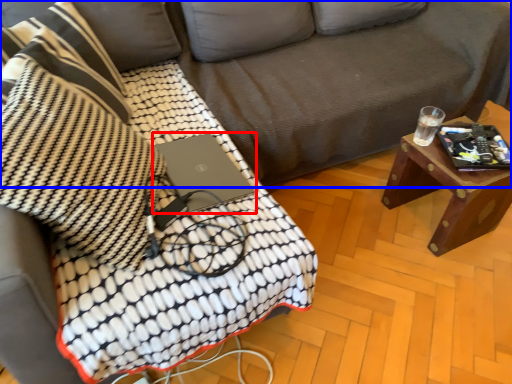
Question: Which of the following is the closest to the observer, laptop (highlighted by a red box) or studio couch (highlighted by a blue box)?

Choices:
 (A) laptop
 (B) studio couch

Answer: (B)